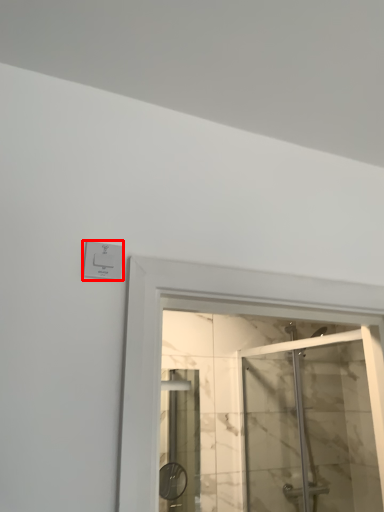
Question: From the image's perspective, what is the correct spatial relationship of electric outlet (annotated by the red box) in relation to screen door?

Choices:
 (A) below
 (B) above

Answer: (B)